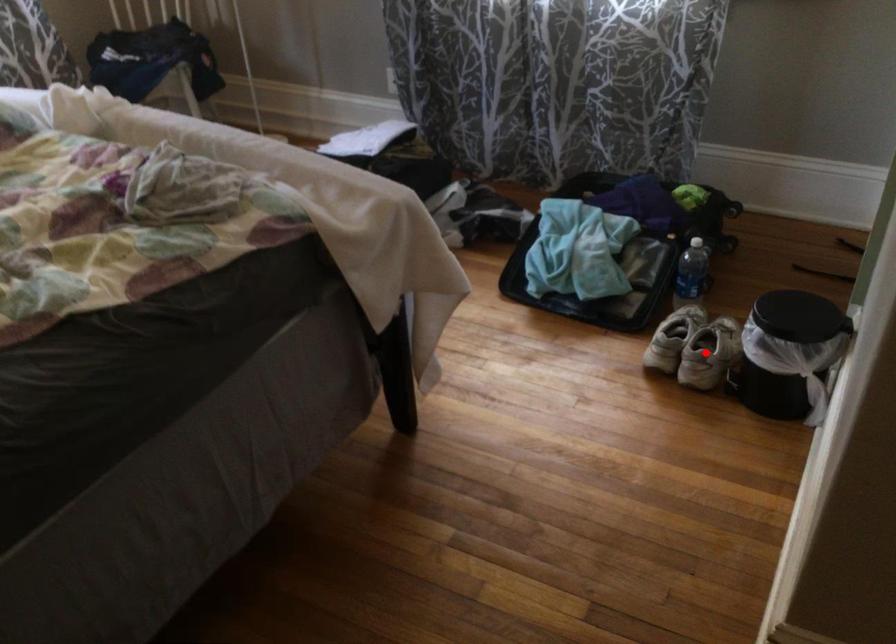
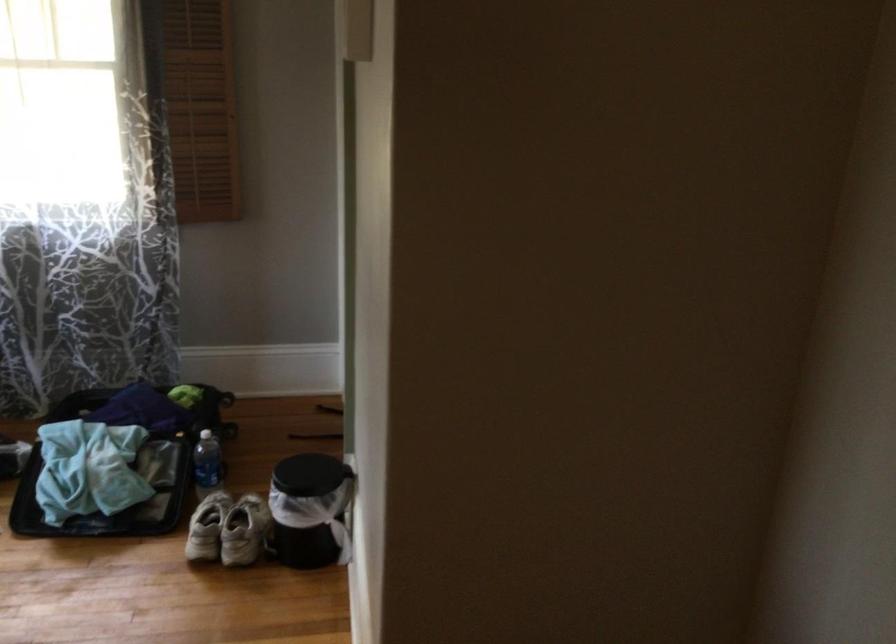
Question: I am providing you with two images of the same scene from different viewpoints. Image1 has a red point marked. In image2, the corresponding 3D location appears at what relative position? Reply with the corresponding letter.

Choices:
 (A) Closer
 (B) Farther

Answer: (B)